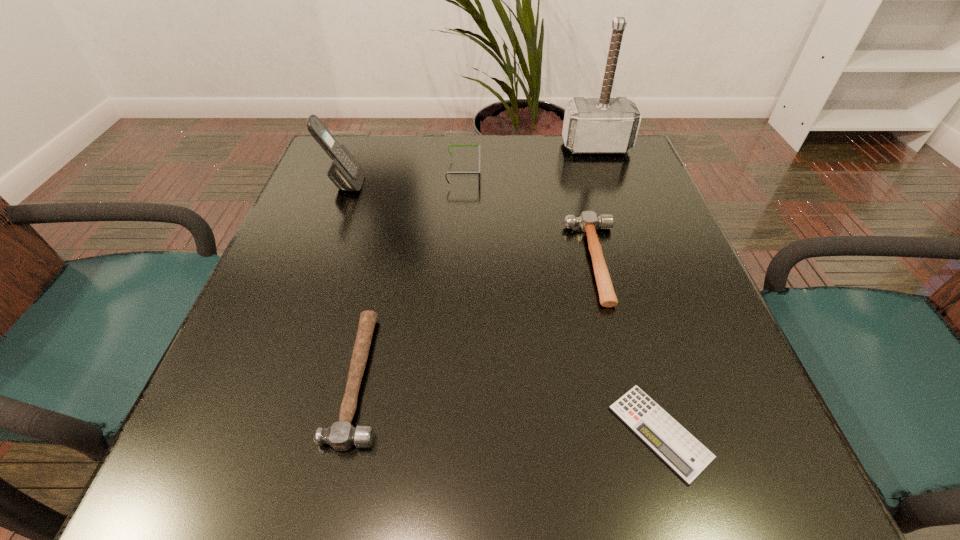
At what (x,y) coordinates should I click in order to perform the action: click on vacant point located between the farthest object and the spectacles. Please return your answer as a coordinate pair (x, y). Image resolution: width=960 pixels, height=540 pixels. Looking at the image, I should click on (530, 160).

You are a GUI agent. You are given a task and a screenshot of the screen. Output one action in this format:
    pyautogui.click(x=<x>, y=<y>)
    Task: Click on the vacant area that lies between the shortest object and the third tallest object
    This screenshot has height=540, width=960.
    Given the screenshot: What is the action you would take?
    pyautogui.click(x=562, y=302)

Identify the location of unoccupied position between the shortest object and the leftmost hammer. [510, 405].

Identify the location of empty space that is in between the second farthest hammer and the second object from left to right. [x=477, y=320].

Identify which object is located as the third nearest to the third tallest object. Please provide its 2D coordinates. Your answer should be formatted as a tuple, i.e. [(x, y)], where the tuple contains the x and y coordinates of a point satisfying the conditions above.

[(604, 125)]

Point out which object is positioned as the third nearest to the shortest object. Please provide its 2D coordinates. Your answer should be formatted as a tuple, i.e. [(x, y)], where the tuple contains the x and y coordinates of a point satisfying the conditions above.

[(449, 145)]

Find the location of `hammer that is the closest one to the second farthest hammer`. hammer that is the closest one to the second farthest hammer is located at coordinates (604, 125).

You are a GUI agent. You are given a task and a screenshot of the screen. Output one action in this format:
    pyautogui.click(x=<x>, y=<y>)
    Task: Click on the closest hammer relative to the calculator
    
    Given the screenshot: What is the action you would take?
    pyautogui.click(x=588, y=221)

You are a GUI agent. You are given a task and a screenshot of the screen. Output one action in this format:
    pyautogui.click(x=<x>, y=<y>)
    Task: Click on the free space in the image that satisfies the following two spatial constraints: 1. on the lens of the second nearest hammer; 2. on the left side of the spectacles
    The height and width of the screenshot is (540, 960).
    Given the screenshot: What is the action you would take?
    pyautogui.click(x=460, y=261)

This screenshot has height=540, width=960. Identify the location of free location that satisfies the following two spatial constraints: 1. for striking with the head of the tallest object; 2. on the lens of the spectacles. pos(606,173).